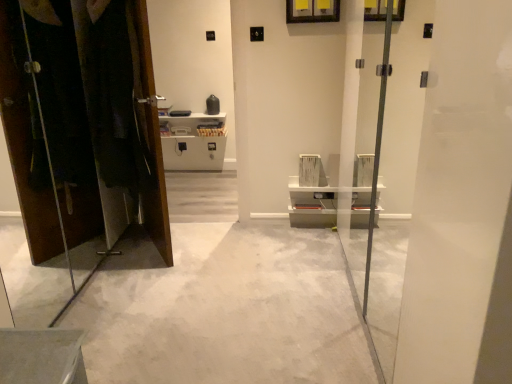
Question: Is dark fabric laundry at left facing towards matte brown dresser at left?

Choices:
 (A) no
 (B) yes

Answer: (A)

Question: Does dark fabric laundry at left have a lesser height compared to matte brown dresser at left?

Choices:
 (A) yes
 (B) no

Answer: (A)

Question: Does dark fabric laundry at left have a smaller size compared to matte brown dresser at left?

Choices:
 (A) no
 (B) yes

Answer: (B)

Question: Is dark fabric laundry at left completely or partially outside of matte brown dresser at left?

Choices:
 (A) yes
 (B) no

Answer: (A)

Question: From a real-world perspective, is dark fabric laundry at left positioned under matte brown dresser at left based on gravity?

Choices:
 (A) no
 (B) yes

Answer: (A)

Question: Looking at the image, does matte brown dresser at left seem bigger or smaller compared to dark fabric laundry at left?

Choices:
 (A) small
 (B) big

Answer: (B)

Question: From the image's perspective, is matte brown dresser at left above or below dark fabric laundry at left?

Choices:
 (A) above
 (B) below

Answer: (B)

Question: Would you say matte brown dresser at left is to the left or to the right of dark fabric laundry at left in the picture?

Choices:
 (A) left
 (B) right

Answer: (A)

Question: Considering the positions of matte brown dresser at left and dark fabric laundry at left in the image, is matte brown dresser at left taller or shorter than dark fabric laundry at left?

Choices:
 (A) short
 (B) tall

Answer: (B)

Question: Is dark fabric laundry at left bigger or smaller than white concrete floor at center?

Choices:
 (A) big
 (B) small

Answer: (B)

Question: Considering the relative positions of dark fabric laundry at left and white concrete floor at center in the image provided, is dark fabric laundry at left to the left or to the right of white concrete floor at center?

Choices:
 (A) left
 (B) right

Answer: (A)

Question: Does point (137, 39) appear closer or farther from the camera than point (311, 306)?

Choices:
 (A) closer
 (B) farther

Answer: (B)

Question: Is dark fabric laundry at left situated inside white concrete floor at center or outside?

Choices:
 (A) outside
 (B) inside

Answer: (A)

Question: Considering the positions of transparent glass screen door at center and dark fabric laundry at left in the image, is transparent glass screen door at center wider or thinner than dark fabric laundry at left?

Choices:
 (A) thin
 (B) wide

Answer: (B)

Question: In terms of height, does transparent glass screen door at center look taller or shorter compared to dark fabric laundry at left?

Choices:
 (A) tall
 (B) short

Answer: (A)